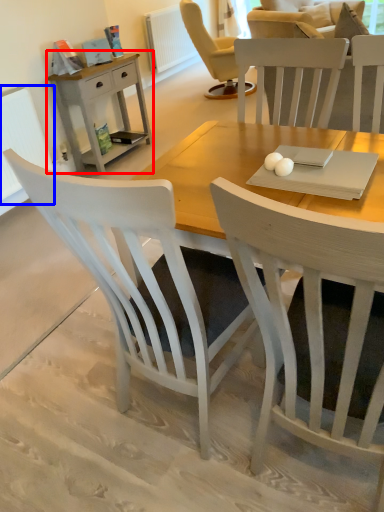
Question: Which point is closer to the camera, nightstand (highlighted by a red box) or radiator (highlighted by a blue box)?

Choices:
 (A) nightstand
 (B) radiator

Answer: (B)